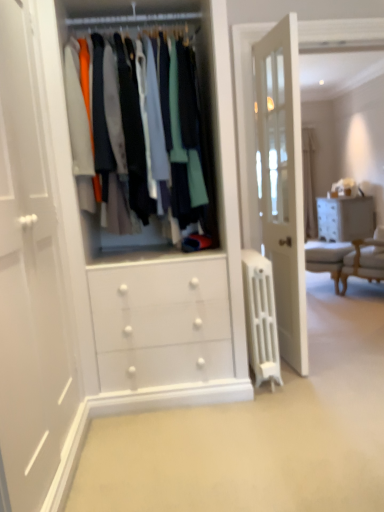
Question: From a real-world perspective, is white painted radiator at center physically below light beige fabric armchair at right?

Choices:
 (A) yes
 (B) no

Answer: (A)

Question: Is white painted radiator at center bigger than light beige fabric armchair at right?

Choices:
 (A) yes
 (B) no

Answer: (B)

Question: Considering the relative sizes of white painted radiator at center and light beige fabric armchair at right in the image provided, is white painted radiator at center thinner than light beige fabric armchair at right?

Choices:
 (A) no
 (B) yes

Answer: (A)

Question: Is white painted radiator at center to the right of light beige fabric armchair at right from the viewer's perspective?

Choices:
 (A) no
 (B) yes

Answer: (A)

Question: Is white painted radiator at center positioned before light beige fabric armchair at right?

Choices:
 (A) yes
 (B) no

Answer: (A)

Question: Is white painted radiator at center with light beige fabric armchair at right?

Choices:
 (A) no
 (B) yes

Answer: (A)

Question: Considering the relative sizes of white textured chest of drawers at right and matte white clothes at center in the image provided, is white textured chest of drawers at right smaller than matte white clothes at center?

Choices:
 (A) yes
 (B) no

Answer: (A)

Question: Could matte white clothes at center be considered to be inside white textured chest of drawers at right?

Choices:
 (A) no
 (B) yes

Answer: (A)

Question: Can you confirm if white textured chest of drawers at right is positioned to the right of matte white clothes at center?

Choices:
 (A) yes
 (B) no

Answer: (A)

Question: From the image's perspective, is white textured chest of drawers at right under matte white clothes at center?

Choices:
 (A) no
 (B) yes

Answer: (A)

Question: From a real-world perspective, does white textured chest of drawers at right stand above matte white clothes at center?

Choices:
 (A) no
 (B) yes

Answer: (A)

Question: Can you confirm if white textured chest of drawers at right is shorter than matte white clothes at center?

Choices:
 (A) yes
 (B) no

Answer: (A)

Question: Is white textured chest of drawers at right further to camera compared to light beige fabric armchair at right?

Choices:
 (A) no
 (B) yes

Answer: (B)